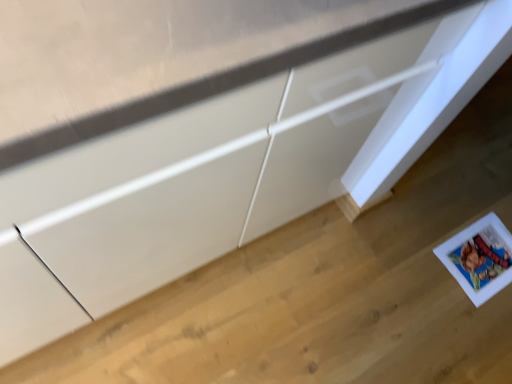
I want to click on vacant region above white paper postcard at lower right (from a real-world perspective), so click(x=483, y=259).